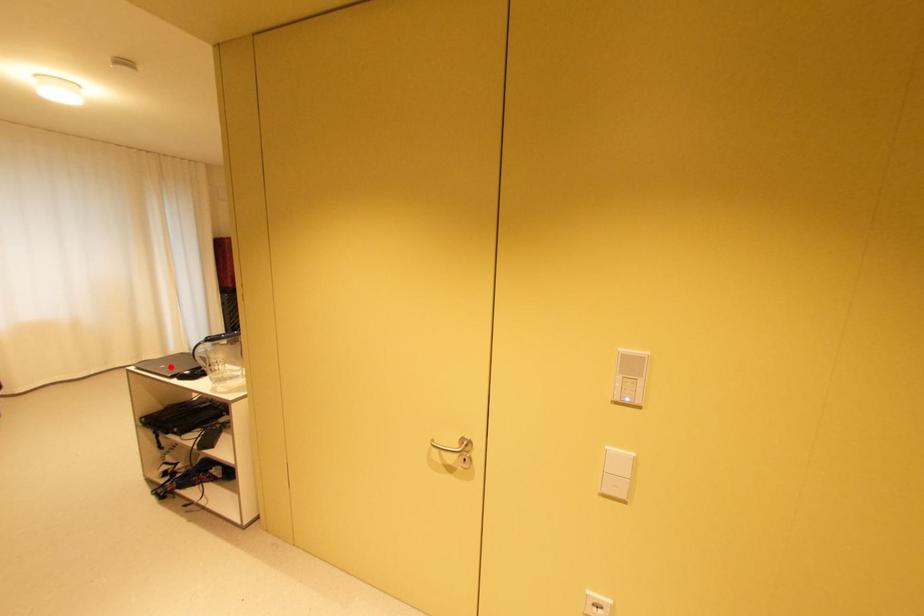
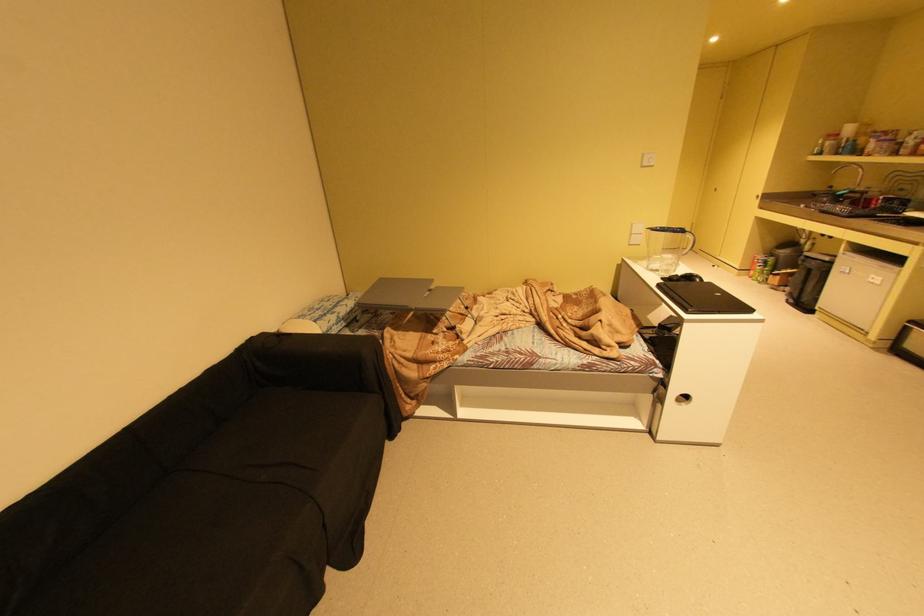
The point at the highlighted location is marked in the first image. Where is the corresponding point in the second image?

(726, 294)